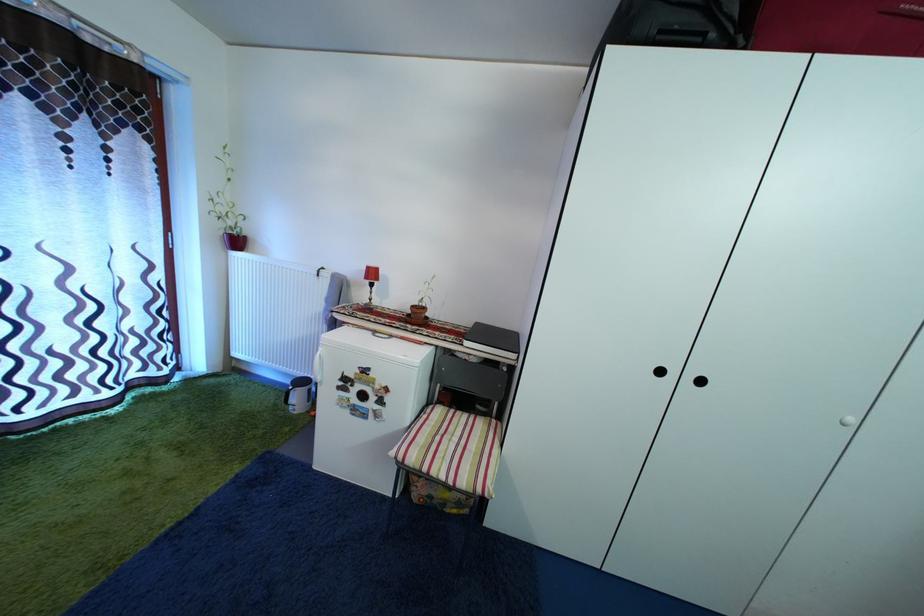
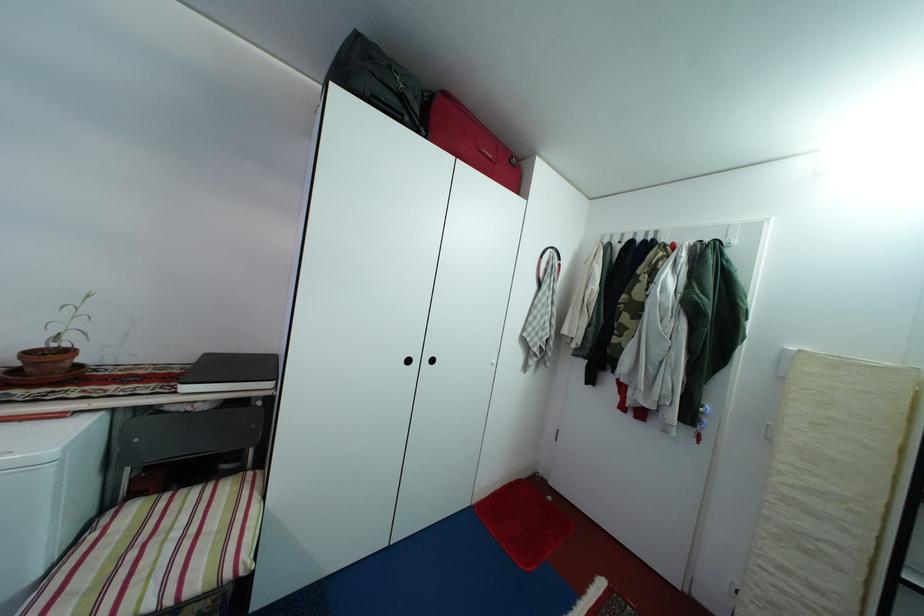
Find the pixel in the second image that matches the point at 417,431 in the first image.

(47, 581)